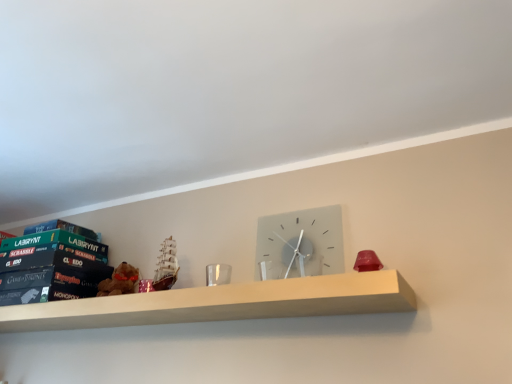
This screenshot has width=512, height=384. Find the location of `green matte board game box at left, which appears as the second paperback book when ordered from the bottom`. green matte board game box at left, which appears as the second paperback book when ordered from the bottom is located at coordinates (54, 245).

At what (x,y) coordinates should I click in order to perform the action: click on green matte board game at left, positioned as the third paperback book in bottom-to-top order. Please return your answer as a coordinate pair (x, y). The width and height of the screenshot is (512, 384). Looking at the image, I should click on [x=61, y=228].

What do you see at coordinates (61, 228) in the screenshot?
I see `green matte board game at left, positioned as the third paperback book in bottom-to-top order` at bounding box center [61, 228].

Locate an element on the screen. The height and width of the screenshot is (384, 512). hardcover book at left, which appears as the 1th paperback book when ordered from the bottom is located at coordinates (51, 267).

This screenshot has height=384, width=512. What do you see at coordinates (222, 303) in the screenshot?
I see `wooden shelf at center` at bounding box center [222, 303].

What do you see at coordinates (302, 242) in the screenshot? The image size is (512, 384). I see `satin gray clock at center` at bounding box center [302, 242].

The width and height of the screenshot is (512, 384). Find the location of `green matte board game box at left, positioned as the 2th paperback book in top-to-bottom order`. green matte board game box at left, positioned as the 2th paperback book in top-to-bottom order is located at coordinates (54, 245).

What's the angular difference between wooden shelf at center and satin gray clock at center's facing directions?

The angular difference between wooden shelf at center and satin gray clock at center is 0.022 degrees.

From a real-world perspective, is wooden shelf at center above or below satin gray clock at center?

wooden shelf at center is below satin gray clock at center.

Does wooden shelf at center contain satin gray clock at center?

No.

From the image's perspective, which one is positioned higher, wooden shelf at center or satin gray clock at center?

satin gray clock at center is shown above in the image.

Does green matte board game box at left, which appears as the second paperback book when ordered from the bottom, have a greater width compared to hardcover book at left, positioned as the third paperback book in top-to-bottom order?

No, green matte board game box at left, which appears as the second paperback book when ordered from the bottom, is not wider than hardcover book at left, positioned as the third paperback book in top-to-bottom order.

How different are the orientations of green matte board game box at left, positioned as the 2th paperback book in top-to-bottom order, and hardcover book at left, which appears as the 1th paperback book when ordered from the bottom, in degrees?

green matte board game box at left, positioned as the 2th paperback book in top-to-bottom order, and hardcover book at left, which appears as the 1th paperback book when ordered from the bottom, are facing 0.00114 degrees away from each other.

Are green matte board game box at left, positioned as the 2th paperback book in top-to-bottom order, and hardcover book at left, which appears as the 1th paperback book when ordered from the bottom, far apart?

No, green matte board game box at left, positioned as the 2th paperback book in top-to-bottom order, is not far from hardcover book at left, which appears as the 1th paperback book when ordered from the bottom.

From the image's perspective, between green matte board game box at left, which appears as the second paperback book when ordered from the bottom, and hardcover book at left, positioned as the third paperback book in top-to-bottom order, which one is located above?

green matte board game box at left, which appears as the second paperback book when ordered from the bottom, is shown above in the image.

Considering the points (255, 290) and (42, 229), which point is behind, point (255, 290) or point (42, 229)?

The point (42, 229) is behind.

Is wooden shelf at center aimed at green matte board game at left, positioned as the third paperback book in bottom-to-top order?

No, wooden shelf at center does not turn towards green matte board game at left, positioned as the third paperback book in bottom-to-top order.

Does wooden shelf at center have a lesser height compared to green matte board game at left, positioned as the third paperback book in bottom-to-top order?

Indeed, wooden shelf at center has a lesser height compared to green matte board game at left, positioned as the third paperback book in bottom-to-top order.

Is hardcover book at left, positioned as the third paperback book in top-to-bottom order, aimed at satin gray clock at center?

No, hardcover book at left, positioned as the third paperback book in top-to-bottom order, is not oriented towards satin gray clock at center.

Is hardcover book at left, positioned as the third paperback book in top-to-bottom order, not within satin gray clock at center?

Yes, hardcover book at left, positioned as the third paperback book in top-to-bottom order, is not within satin gray clock at center.

Based on the photo, are hardcover book at left, positioned as the third paperback book in top-to-bottom order, and satin gray clock at center beside each other?

No.

Which object is thinner, hardcover book at left, positioned as the third paperback book in top-to-bottom order, or green matte board game at left, positioned as the third paperback book in bottom-to-top order?

Thinner between the two is green matte board game at left, positioned as the third paperback book in bottom-to-top order.

Is hardcover book at left, which appears as the 1th paperback book when ordered from the bottom, in front of or behind green matte board game at left, positioned as the third paperback book in bottom-to-top order, in the image?

hardcover book at left, which appears as the 1th paperback book when ordered from the bottom, is in front of green matte board game at left, positioned as the third paperback book in bottom-to-top order.

In the scene shown: Can you confirm if hardcover book at left, positioned as the third paperback book in top-to-bottom order, is shorter than green matte board game at left, which ranks as the 1th paperback book in top-to-bottom order?

Incorrect, the height of hardcover book at left, positioned as the third paperback book in top-to-bottom order, does not fall short of that of green matte board game at left, which ranks as the 1th paperback book in top-to-bottom order.

Do you think hardcover book at left, positioned as the third paperback book in top-to-bottom order, is within green matte board game at left, positioned as the third paperback book in bottom-to-top order, or outside of it?

hardcover book at left, positioned as the third paperback book in top-to-bottom order, exists outside the volume of green matte board game at left, positioned as the third paperback book in bottom-to-top order.

Consider the image. Is green matte board game box at left, positioned as the 2th paperback book in top-to-bottom order, wider than green matte board game at left, which ranks as the 1th paperback book in top-to-bottom order?

Correct, the width of green matte board game box at left, positioned as the 2th paperback book in top-to-bottom order, exceeds that of green matte board game at left, which ranks as the 1th paperback book in top-to-bottom order.

Based on the photo, could you tell me if green matte board game box at left, positioned as the 2th paperback book in top-to-bottom order, is turned towards green matte board game at left, positioned as the third paperback book in bottom-to-top order?

No, green matte board game box at left, positioned as the 2th paperback book in top-to-bottom order, is not aimed at green matte board game at left, positioned as the third paperback book in bottom-to-top order.

From a real-world perspective, is green matte board game box at left, positioned as the 2th paperback book in top-to-bottom order, below green matte board game at left, positioned as the third paperback book in bottom-to-top order?

Indeed, from a real-world perspective, green matte board game box at left, positioned as the 2th paperback book in top-to-bottom order, is positioned beneath green matte board game at left, positioned as the third paperback book in bottom-to-top order.

From a real-world perspective, which object stands above the other?

In real-world perspective, satin gray clock at center is above.

Between point (265, 262) and point (380, 289), which one is positioned in front?

The point (380, 289) is in front.

Which of these two, satin gray clock at center or wooden shelf at center, is wider?

Wider between the two is wooden shelf at center.

In the image, there is a satin gray clock at center. Where is `shelf below it (from the image's perspective)`? This screenshot has width=512, height=384. shelf below it (from the image's perspective) is located at coordinates (222, 303).

Starting from the hardcover book at left, positioned as the third paperback book in top-to-bottom order, which paperback book is the 1st one behind? Please provide its 2D coordinates.

[(54, 245)]

From the image, which object appears to be nearer to green matte board game box at left, which appears as the second paperback book when ordered from the bottom, hardcover book at left, which appears as the 1th paperback book when ordered from the bottom, or satin gray clock at center?

hardcover book at left, which appears as the 1th paperback book when ordered from the bottom, is positioned closer to the anchor green matte board game box at left, which appears as the second paperback book when ordered from the bottom.

From the picture: When comparing their distances from hardcover book at left, which appears as the 1th paperback book when ordered from the bottom, does satin gray clock at center or green matte board game box at left, which appears as the second paperback book when ordered from the bottom, seem further?

Among the two, satin gray clock at center is located further to hardcover book at left, which appears as the 1th paperback book when ordered from the bottom.

From the image, which object appears to be nearer to satin gray clock at center, green matte board game at left, positioned as the third paperback book in bottom-to-top order, or hardcover book at left, which appears as the 1th paperback book when ordered from the bottom?

hardcover book at left, which appears as the 1th paperback book when ordered from the bottom, lies closer to satin gray clock at center than the other object.

Considering their positions, is green matte board game box at left, positioned as the 2th paperback book in top-to-bottom order, positioned further to satin gray clock at center than wooden shelf at center?

The object further to satin gray clock at center is green matte board game box at left, positioned as the 2th paperback book in top-to-bottom order.

Estimate the real-world distances between objects in this image. Which object is closer to green matte board game box at left, which appears as the second paperback book when ordered from the bottom, green matte board game at left, which ranks as the 1th paperback book in top-to-bottom order, or wooden shelf at center?

green matte board game at left, which ranks as the 1th paperback book in top-to-bottom order, is positioned closer to the anchor green matte board game box at left, which appears as the second paperback book when ordered from the bottom.

Which object lies nearer to the anchor point satin gray clock at center, green matte board game box at left, which appears as the second paperback book when ordered from the bottom, or green matte board game at left, which ranks as the 1th paperback book in top-to-bottom order?

green matte board game box at left, which appears as the second paperback book when ordered from the bottom, is closer to satin gray clock at center.

From the image, which object appears to be nearer to green matte board game box at left, positioned as the 2th paperback book in top-to-bottom order, green matte board game at left, positioned as the third paperback book in bottom-to-top order, or satin gray clock at center?

Based on the image, green matte board game at left, positioned as the third paperback book in bottom-to-top order, appears to be nearer to green matte board game box at left, positioned as the 2th paperback book in top-to-bottom order.

Considering their positions, is hardcover book at left, positioned as the third paperback book in top-to-bottom order, positioned closer to satin gray clock at center than green matte board game box at left, which appears as the second paperback book when ordered from the bottom?

hardcover book at left, positioned as the third paperback book in top-to-bottom order, is closer to satin gray clock at center.

Locate an element on the screen. paperback book between wooden shelf at center and green matte board game box at left, which appears as the second paperback book when ordered from the bottom, in the front-back direction is located at coordinates (51, 267).

Find the location of a particular element. shelf between green matte board game at left, positioned as the third paperback book in bottom-to-top order, and satin gray clock at center from left to right is located at coordinates (222, 303).

At what (x,y) coordinates should I click in order to perform the action: click on shelf between hardcover book at left, positioned as the third paperback book in top-to-bottom order, and satin gray clock at center. Please return your answer as a coordinate pair (x, y). The width and height of the screenshot is (512, 384). Looking at the image, I should click on (222, 303).

Where is `shelf between green matte board game box at left, which appears as the second paperback book when ordered from the bottom, and satin gray clock at center`? The image size is (512, 384). shelf between green matte board game box at left, which appears as the second paperback book when ordered from the bottom, and satin gray clock at center is located at coordinates (222, 303).